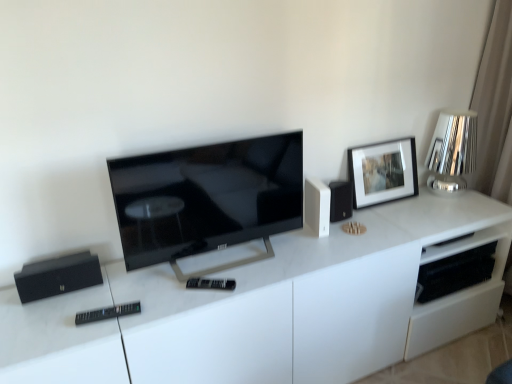
The width and height of the screenshot is (512, 384). I want to click on empty space that is ontop of black matte speaker at left (from a real-world perspective), so pyautogui.click(x=49, y=266).